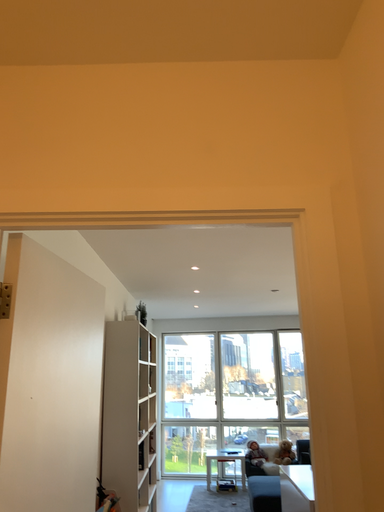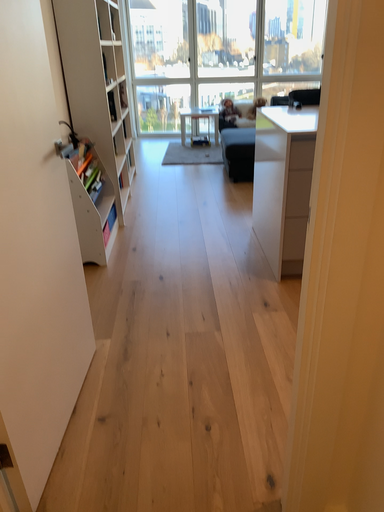
Question: Which way did the camera rotate in the video?

Choices:
 (A) rotated upward
 (B) rotated downward

Answer: (B)